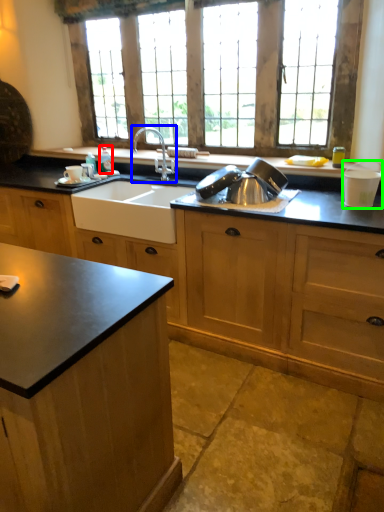
Question: Considering the real-world distances, which object is farthest from bottle (highlighted by a red box)? tap (highlighted by a blue box) or appliance (highlighted by a green box)?

Choices:
 (A) tap
 (B) appliance

Answer: (B)